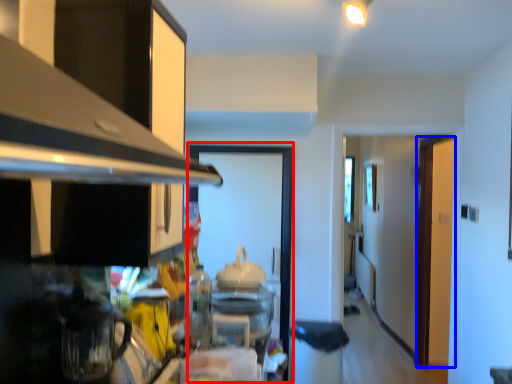
Question: Which object appears closest to the camera in this image, glass door (highlighted by a red box) or door (highlighted by a blue box)?

Choices:
 (A) glass door
 (B) door

Answer: (A)